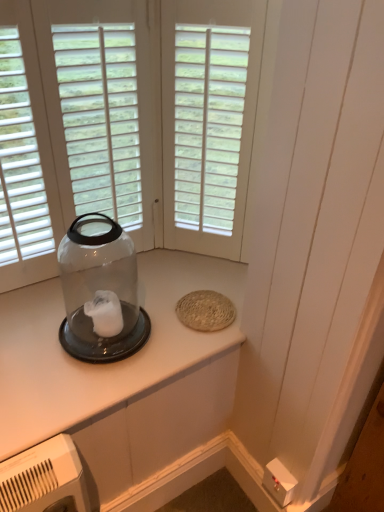
Find the location of a particular element. vacant space that's between transparent glass jar at left and white matte window at center is located at coordinates (167, 284).